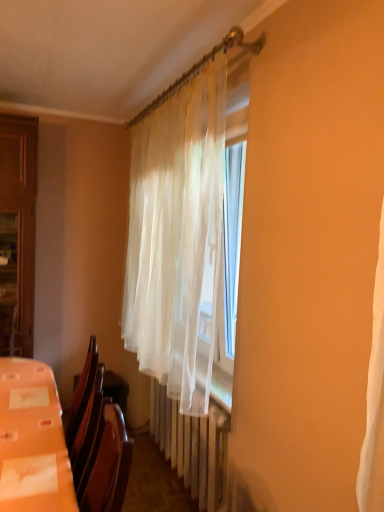
Question: From a real-world perspective, is translucent white curtain at center physically above white plastic radiator at center?

Choices:
 (A) no
 (B) yes

Answer: (B)

Question: Is translucent white curtain at center facing towards white plastic radiator at center?

Choices:
 (A) yes
 (B) no

Answer: (B)

Question: Is translucent white curtain at center located outside white plastic radiator at center?

Choices:
 (A) yes
 (B) no

Answer: (A)

Question: From the image's perspective, is translucent white curtain at center on top of white plastic radiator at center?

Choices:
 (A) yes
 (B) no

Answer: (A)

Question: Is translucent white curtain at center in contact with white plastic radiator at center?

Choices:
 (A) yes
 (B) no

Answer: (B)

Question: Considering the relative sizes of translucent white curtain at center and white plastic radiator at center in the image provided, is translucent white curtain at center wider than white plastic radiator at center?

Choices:
 (A) yes
 (B) no

Answer: (A)

Question: Is translucent white curtain at center surrounded by orange plastic table at lower left?

Choices:
 (A) no
 (B) yes

Answer: (A)

Question: Considering the relative positions of orange plastic table at lower left and translucent white curtain at center in the image provided, is orange plastic table at lower left to the left of translucent white curtain at center from the viewer's perspective?

Choices:
 (A) yes
 (B) no

Answer: (A)

Question: Does orange plastic table at lower left appear on the right side of translucent white curtain at center?

Choices:
 (A) yes
 (B) no

Answer: (B)

Question: Does orange plastic table at lower left come in front of translucent white curtain at center?

Choices:
 (A) no
 (B) yes

Answer: (B)

Question: From the image's perspective, is orange plastic table at lower left located beneath translucent white curtain at center?

Choices:
 (A) no
 (B) yes

Answer: (B)

Question: Can you confirm if orange plastic table at lower left is wider than translucent white curtain at center?

Choices:
 (A) yes
 (B) no

Answer: (A)

Question: Is white plastic radiator at center behind orange plastic table at lower left?

Choices:
 (A) no
 (B) yes

Answer: (B)